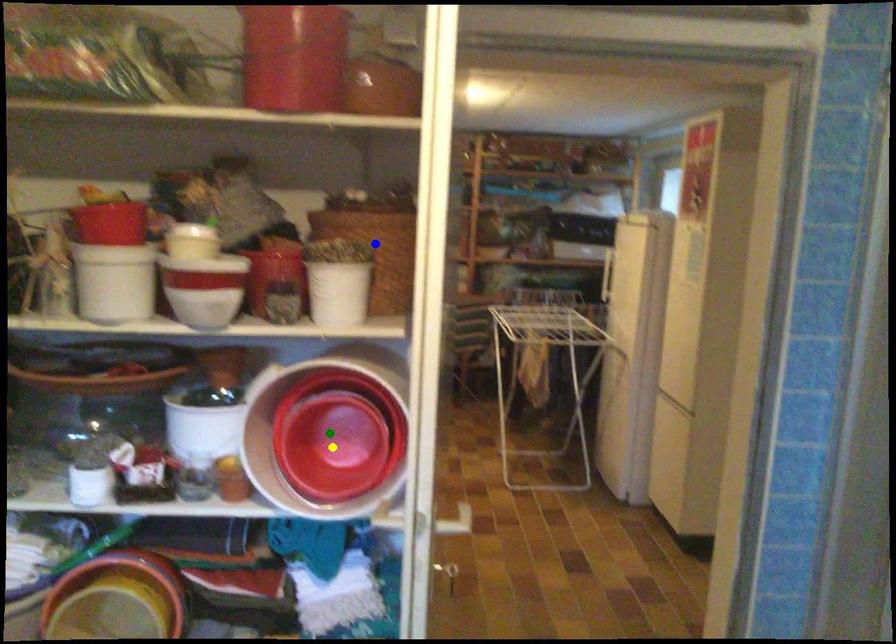
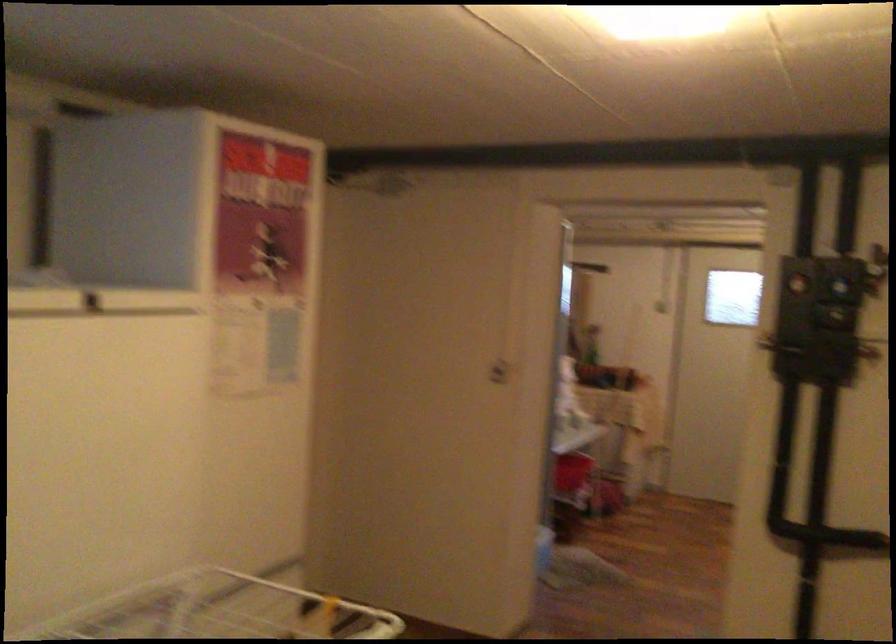
I am providing you with two images of the same scene from different viewpoints. Three points are marked in image1. Which point corresponds to a part or object that is occluded in image2?In image1, three points are marked. Which of them correspond to a part or object that is occluded in image2?Among the three points shown in image1, which one corresponds to a part or object that is no longer visible due to occlusion in image2?

green point, blue point, yellow point cannot be seen in image2.